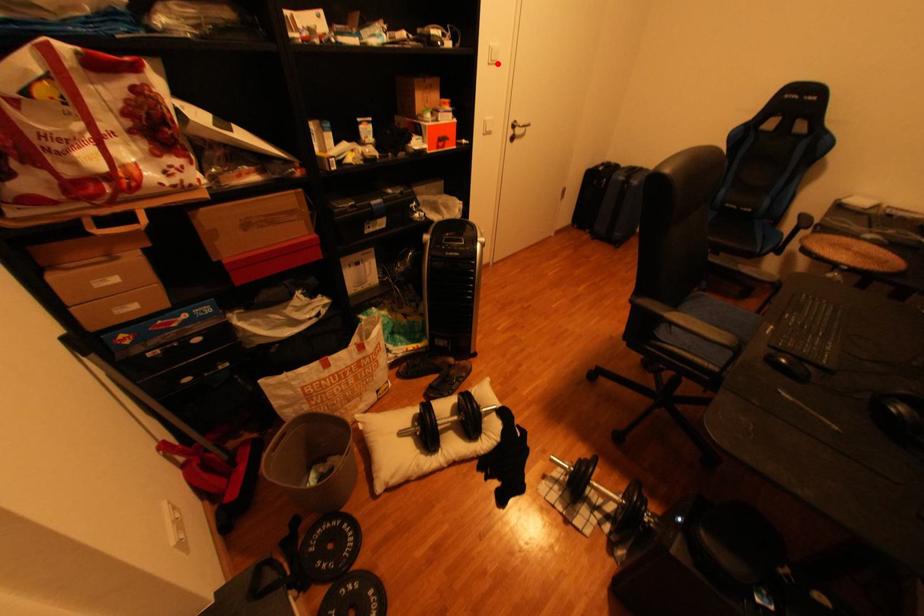
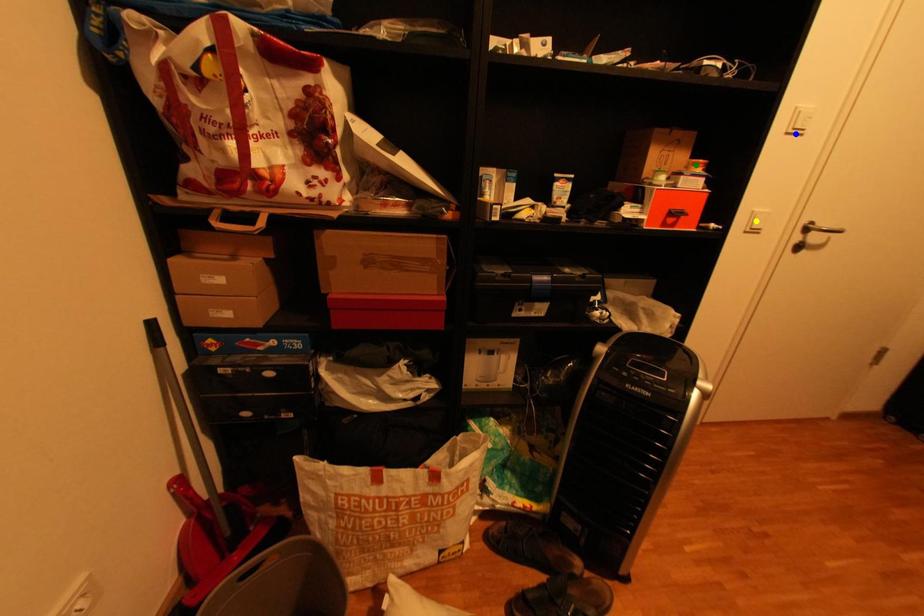
Question: I am providing you with two images of the same scene from different viewpoints. A red point is marked on the first image. You are given multiple points on the second image. Which point in image 2 represents the same 3d spot as the red point in image 1?

Choices:
 (A) yellow point
 (B) green point
 (C) blue point

Answer: (C)